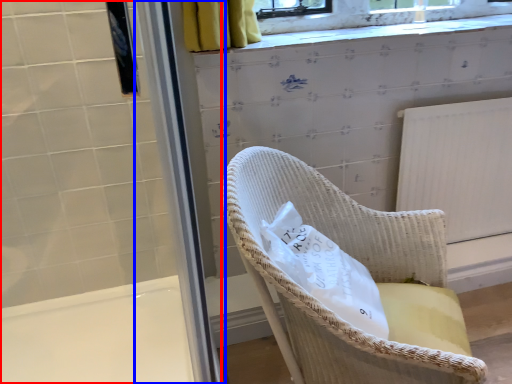
Question: Which object is closer to the camera taking this photo, screen door (highlighted by a red box) or screen door (highlighted by a blue box)?

Choices:
 (A) screen door
 (B) screen door

Answer: (B)